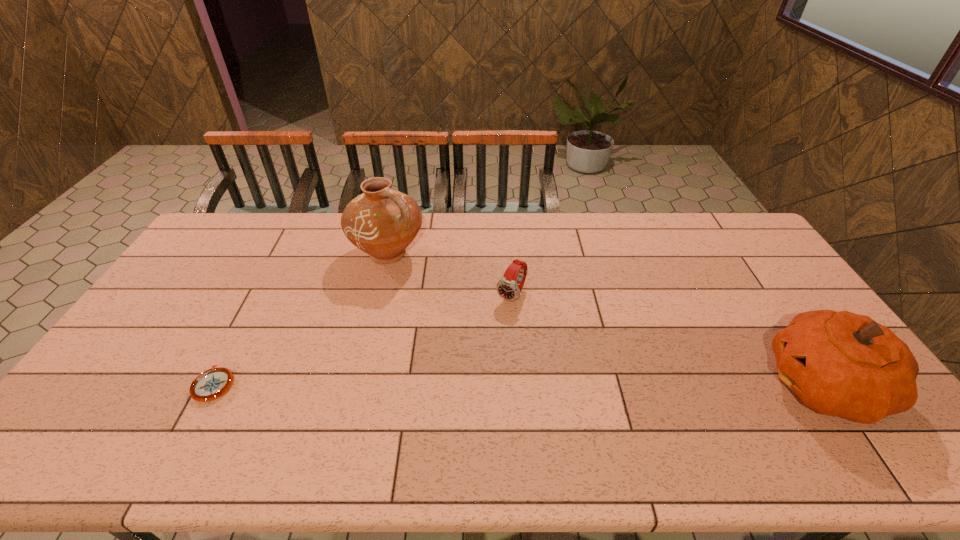
Identify the location of pumpkin present at the near edge. This screenshot has height=540, width=960. (842, 364).

Locate an element on the screen. This screenshot has height=540, width=960. object at the right edge is located at coordinates click(x=842, y=364).

Locate an element on the screen. This screenshot has height=540, width=960. object at the near right corner is located at coordinates (842, 364).

The height and width of the screenshot is (540, 960). Find the location of `vacant space at the far edge of the desktop`. vacant space at the far edge of the desktop is located at coordinates (587, 229).

Locate an element on the screen. This screenshot has width=960, height=540. vacant space at the near edge of the desktop is located at coordinates (659, 397).

This screenshot has height=540, width=960. In the image, there is a desktop. In order to click on free region at the left edge in this screenshot , I will do `click(178, 327)`.

In order to click on free space at the right edge of the desktop in this screenshot , I will do `click(739, 262)`.

In order to click on vacant space at the near left corner of the desktop in this screenshot , I will do [x=101, y=393].

Identify the location of vacant region at the far right corner of the desktop. (757, 239).

At what (x,y) coordinates should I click in order to perform the action: click on free spot between the second tallest object and the compass. Please return your answer as a coordinate pair (x, y). Image resolution: width=960 pixels, height=540 pixels. Looking at the image, I should click on (519, 384).